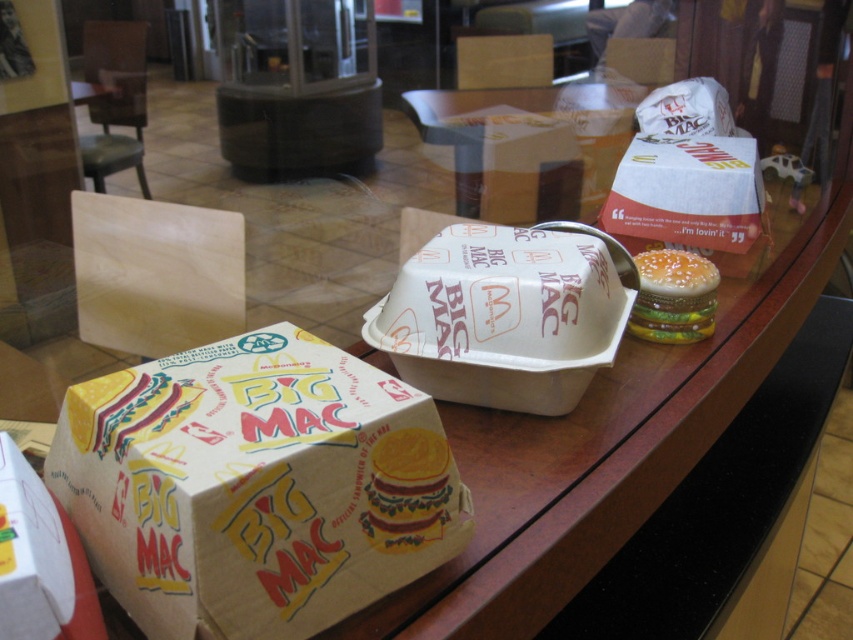
You are a customer at McDonalds and you want to grab the burgundy glossy burger at right. However, there is a yellow paper big mac box at center in the way. Can you reach the burger by moving the box to the left?

The yellow paper big mac box at center is to the left of the burgundy glossy burger at right, so moving the box to the left would create space to reach the burger.

You are a customer at McDonalds and you want to know which Big Mac is bigger. You see the yellow paper big mac at center and the burgundy glossy burger at right. Which one is larger?

The burgundy glossy burger at right is larger than the yellow paper big mac at center.

You are a McDonalds employee who needs to stack the yellow paper big mac box at center and the yellow paper big mac at center on top of each other. Which one should you place at the bottom to ensure stability?

The yellow paper big mac box at center has a greater height compared to the yellow paper big mac at center, so placing it at the bottom would provide a stable base for stacking.